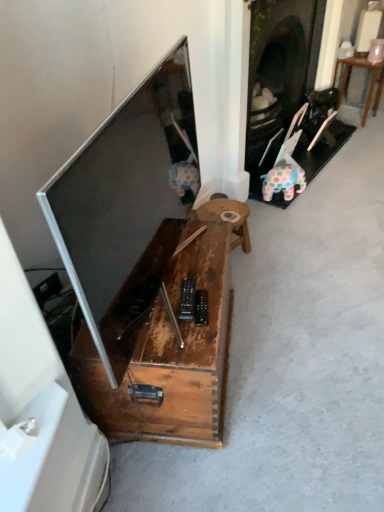
At what (x,y) coordinates should I click in order to perform the action: click on vacant space situated above rustic wood coffee table at center (from a real-world perspective). Please return your answer as a coordinate pair (x, y). Looking at the image, I should click on [x=180, y=286].